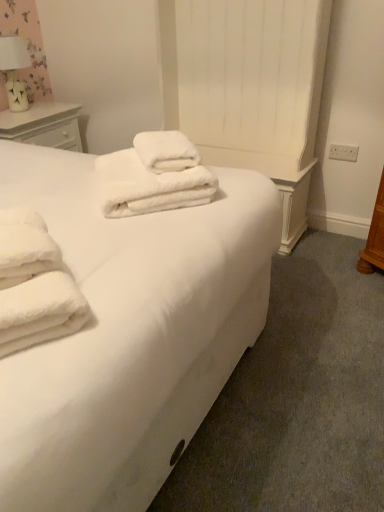
Locate an element on the screen. The height and width of the screenshot is (512, 384). unoccupied area in front of white ceramic table lamp at upper left is located at coordinates (17, 117).